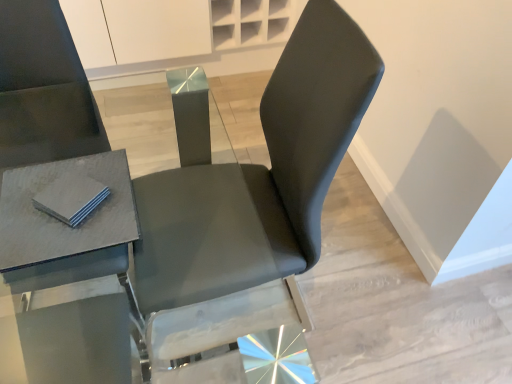
Question: From a real-world perspective, is matte gray table at left positioned under matte black chair at center based on gravity?

Choices:
 (A) no
 (B) yes

Answer: (A)

Question: Is matte gray table at left closer to the viewer compared to matte black chair at center?

Choices:
 (A) no
 (B) yes

Answer: (B)

Question: Is matte gray table at left behind matte black chair at center?

Choices:
 (A) yes
 (B) no

Answer: (B)

Question: Can you confirm if matte gray table at left is smaller than matte black chair at center?

Choices:
 (A) yes
 (B) no

Answer: (A)

Question: Would you say matte gray table at left is a long distance from matte black chair at center?

Choices:
 (A) yes
 (B) no

Answer: (B)

Question: Considering the positions of gray matte pad at upper left and matte black chair at center in the image, is gray matte pad at upper left taller or shorter than matte black chair at center?

Choices:
 (A) tall
 (B) short

Answer: (B)

Question: Looking at their shapes, would you say gray matte pad at upper left is wider or thinner than matte black chair at center?

Choices:
 (A) thin
 (B) wide

Answer: (A)

Question: Looking at the image, does gray matte pad at upper left seem bigger or smaller compared to matte black chair at center?

Choices:
 (A) small
 (B) big

Answer: (A)

Question: Considering their positions, is gray matte pad at upper left located in front of or behind matte black chair at center?

Choices:
 (A) behind
 (B) front

Answer: (A)

Question: From their relative heights in the image, would you say matte black chair at center is taller or shorter than matte gray table at left?

Choices:
 (A) tall
 (B) short

Answer: (B)

Question: Is matte black chair at center inside or outside of matte gray table at left?

Choices:
 (A) outside
 (B) inside

Answer: (A)

Question: From a real-world perspective, relative to matte gray table at left, is matte black chair at center vertically above or below?

Choices:
 (A) below
 (B) above

Answer: (A)

Question: Is point click(305, 132) closer or farther from the camera than point click(117, 160)?

Choices:
 (A) farther
 (B) closer

Answer: (A)

Question: Relative to gray matte pad at upper left, is matte black chair at center in front or behind?

Choices:
 (A) front
 (B) behind

Answer: (A)

Question: In terms of width, does matte black chair at center look wider or thinner when compared to gray matte pad at upper left?

Choices:
 (A) wide
 (B) thin

Answer: (A)